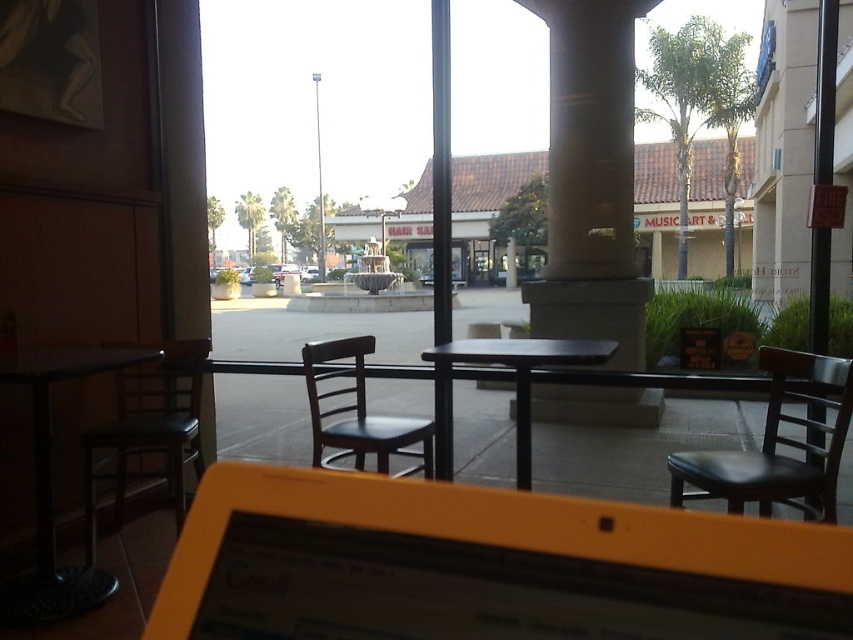
Does transparent glass door at center appear over black metal pole at center?

Yes.

In order to click on transparent glass door at center in this screenshot , I will do `click(311, 332)`.

At what (x,y) coordinates should I click in order to perform the action: click on transparent glass door at center. Please return your answer as a coordinate pair (x, y). Looking at the image, I should click on (311, 332).

Which is more to the right, black leather chair at left or black leather chair at center?

black leather chair at center

Where is `black leather chair at left`? The image size is (853, 640). black leather chair at left is located at coordinates (148, 429).

Measure the distance between yellow plastic laptop at center and camera.

They are 36.18 centimeters apart.

Which is behind, point (219, 577) or point (354, 358)?

The point (354, 358) is behind.

Is point (310, 595) farther from camera compared to point (403, 420)?

That is False.

Identify the location of yellow plastic laptop at center. The height and width of the screenshot is (640, 853). (485, 564).